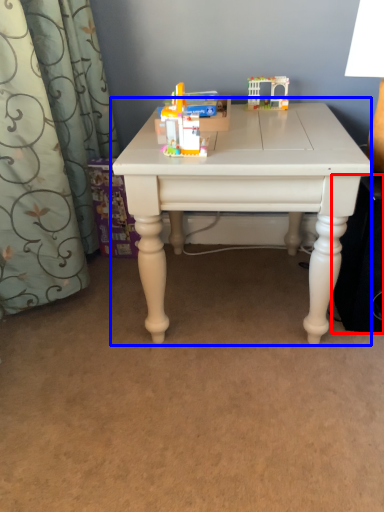
Question: Which point is closer to the camera, speaker (highlighted by a red box) or table (highlighted by a blue box)?

Choices:
 (A) speaker
 (B) table

Answer: (B)